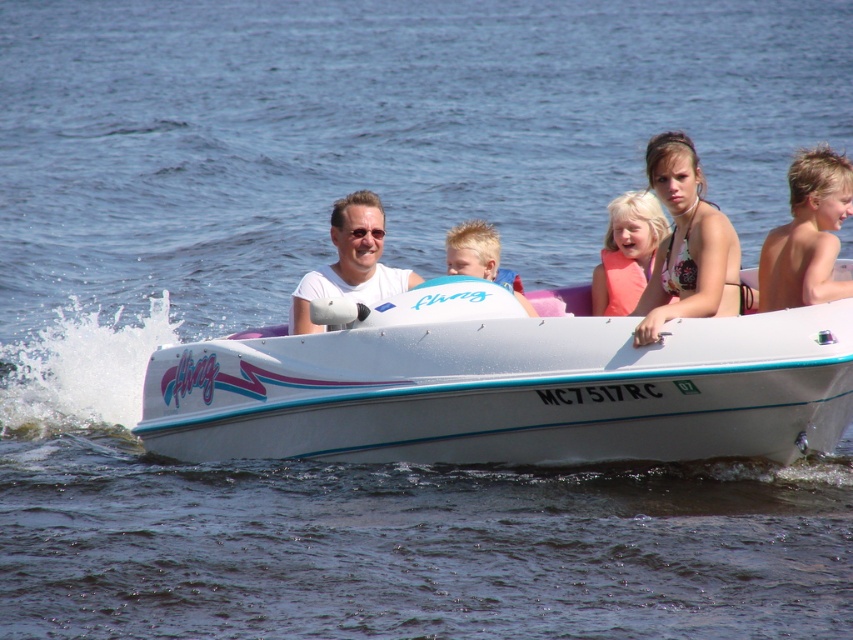
You are a safety inspector checking the placement of life vests on the boat. The boat has a capacity limit of 10 feet between any two passengers for safety. Are the blonde hair at upper right and the matte pink life vest at center within the safe distance?

The blonde hair at upper right is 9.69 feet from the matte pink life vest at center. Since 9.69 feet is under the 10 feet safety limit, they are within the safe distance.

You are a safety inspector checking the boat. You see the matte pink life vest at center and the blonde hair at center. Which object is taller?

The matte pink life vest at center is taller than the blonde hair at center.

You are a photographer taking a photo of the scene. The blonde hair at upper right and the matte pink life vest at center are both in the frame. Which object is positioned higher in the image?

The blonde hair at upper right is much taller than the matte pink life vest at center, so it is positioned higher in the image.